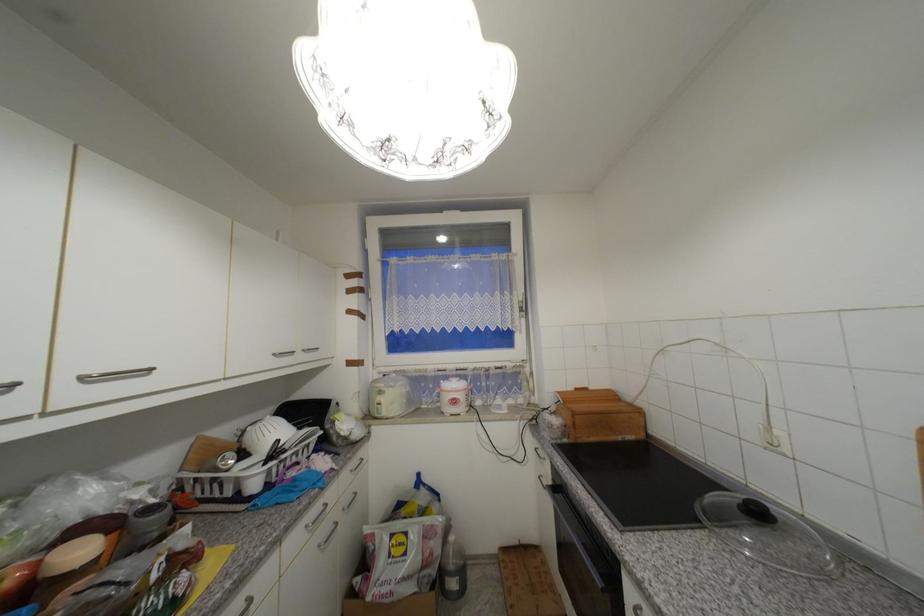
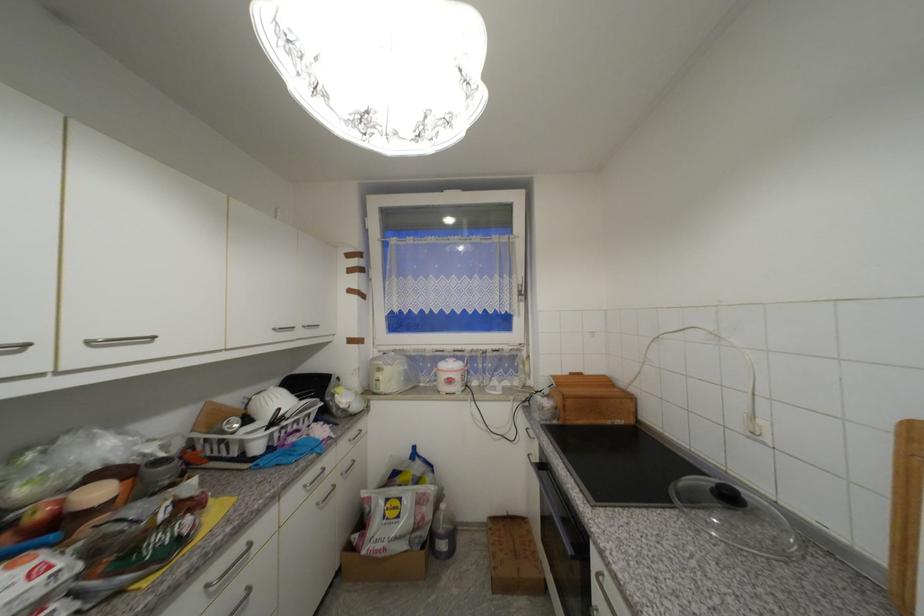
In the second image, find the point that corresponds to (x=357, y=460) in the first image.

(354, 430)